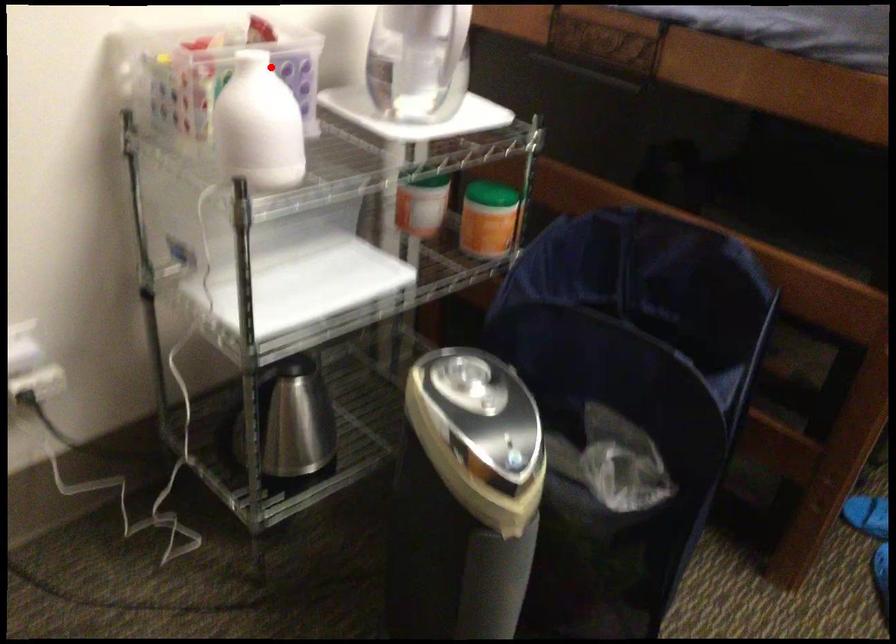
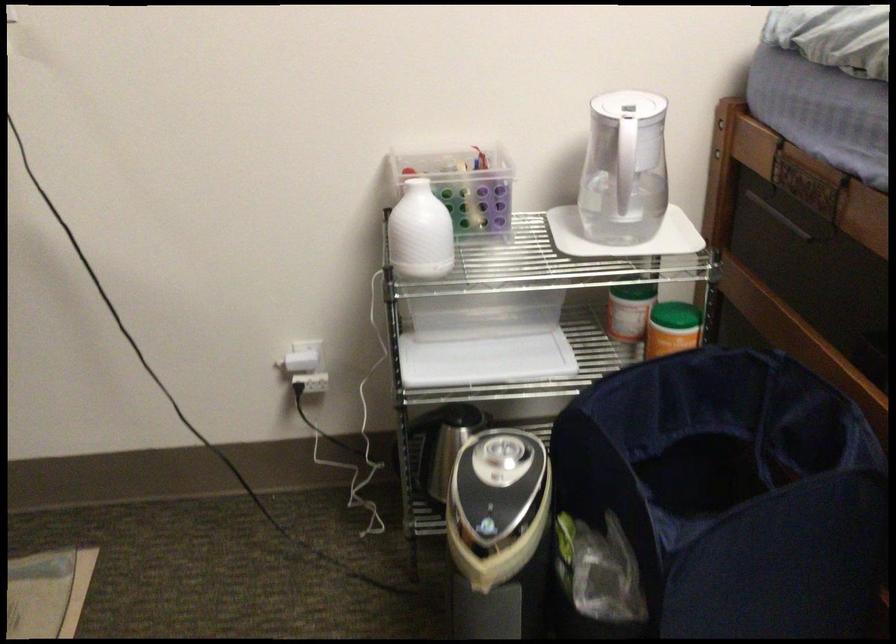
In the second image, find the point that corresponds to the highlighted location in the first image.

(463, 185)